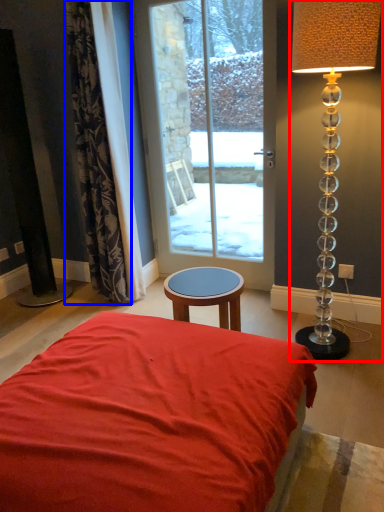
Question: Which of the following is the closest to the observer, lamp (highlighted by a red box) or curtain (highlighted by a blue box)?

Choices:
 (A) lamp
 (B) curtain

Answer: (A)